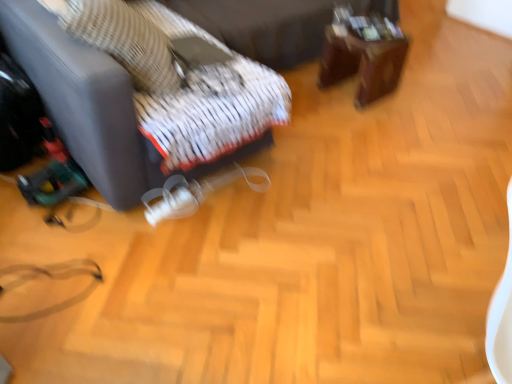
Question: Does brown wooden table at upper right have a greater width compared to white textured fabric bed frame at upper center?

Choices:
 (A) yes
 (B) no

Answer: (B)

Question: Is brown wooden table at upper right not inside white textured fabric bed frame at upper center?

Choices:
 (A) yes
 (B) no

Answer: (A)

Question: Is brown wooden table at upper right oriented away from white textured fabric bed frame at upper center?

Choices:
 (A) no
 (B) yes

Answer: (B)

Question: Considering the relative positions of brown wooden table at upper right and white textured fabric bed frame at upper center in the image provided, is brown wooden table at upper right to the right of white textured fabric bed frame at upper center from the viewer's perspective?

Choices:
 (A) no
 (B) yes

Answer: (B)

Question: From the image's perspective, is brown wooden table at upper right below white textured fabric bed frame at upper center?

Choices:
 (A) no
 (B) yes

Answer: (B)

Question: Is brown wooden table at upper right thinner than white textured fabric bed frame at upper center?

Choices:
 (A) no
 (B) yes

Answer: (B)

Question: Considering the relative sizes of brown wooden table at upper right and woven fabric pillow at upper left in the image provided, is brown wooden table at upper right bigger than woven fabric pillow at upper left?

Choices:
 (A) yes
 (B) no

Answer: (B)

Question: From the image's perspective, does brown wooden table at upper right appear lower than woven fabric pillow at upper left?

Choices:
 (A) no
 (B) yes

Answer: (A)

Question: Would you say brown wooden table at upper right is a long distance from woven fabric pillow at upper left?

Choices:
 (A) yes
 (B) no

Answer: (A)

Question: Is brown wooden table at upper right aimed at woven fabric pillow at upper left?

Choices:
 (A) no
 (B) yes

Answer: (A)

Question: Is brown wooden table at upper right behind woven fabric pillow at upper left?

Choices:
 (A) no
 (B) yes

Answer: (B)

Question: Does brown wooden table at upper right lie in front of woven fabric pillow at upper left?

Choices:
 (A) no
 (B) yes

Answer: (A)

Question: Can you confirm if woven fabric pillow at upper left is smaller than brown wooden table at upper right?

Choices:
 (A) yes
 (B) no

Answer: (B)